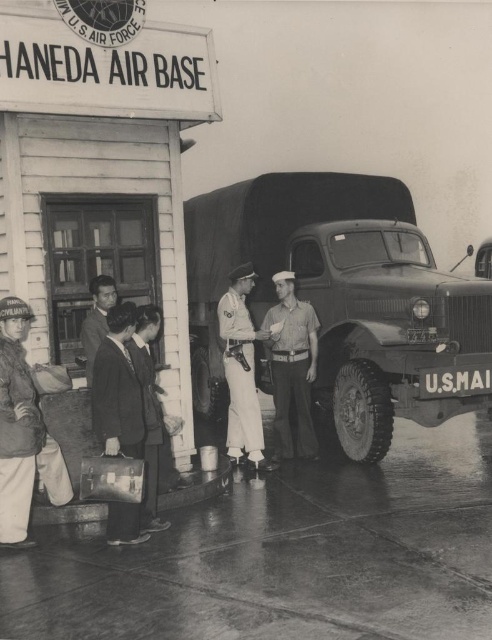
Does white uniform at center appear on the right side of dark suit at center?

Correct, you'll find white uniform at center to the right of dark suit at center.

Is white uniform at center positioned before dark suit at center?

No, it is behind dark suit at center.

This screenshot has width=492, height=640. Find the location of `white uniform at center`. white uniform at center is located at coordinates (242, 369).

Does matte green truck at center come in front of dark suit at center?

No, it is behind dark suit at center.

You are a GUI agent. You are given a task and a screenshot of the screen. Output one action in this format:
    pyautogui.click(x=<x>, y=<y>)
    Task: Click on the matte green truck at center
    
    Given the screenshot: What is the action you would take?
    pyautogui.click(x=351, y=296)

Is matte green truck at center bigger than light brown uniform at center?

Yes, matte green truck at center is bigger than light brown uniform at center.

Can you confirm if matte green truck at center is shorter than light brown uniform at center?

Yes, matte green truck at center is shorter than light brown uniform at center.

Image resolution: width=492 pixels, height=640 pixels. What do you see at coordinates (351, 296) in the screenshot? I see `matte green truck at center` at bounding box center [351, 296].

Identify the location of matte green truck at center. (351, 296).